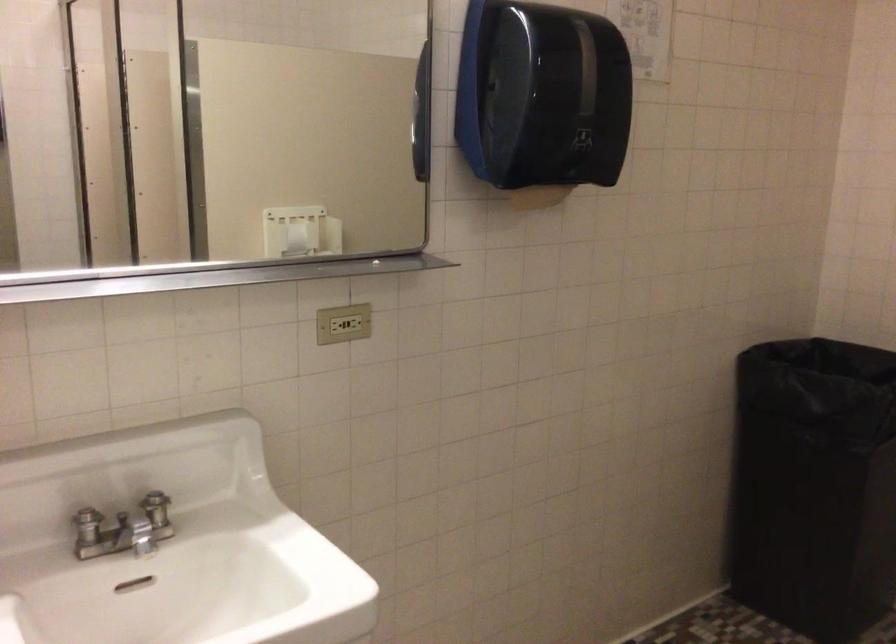
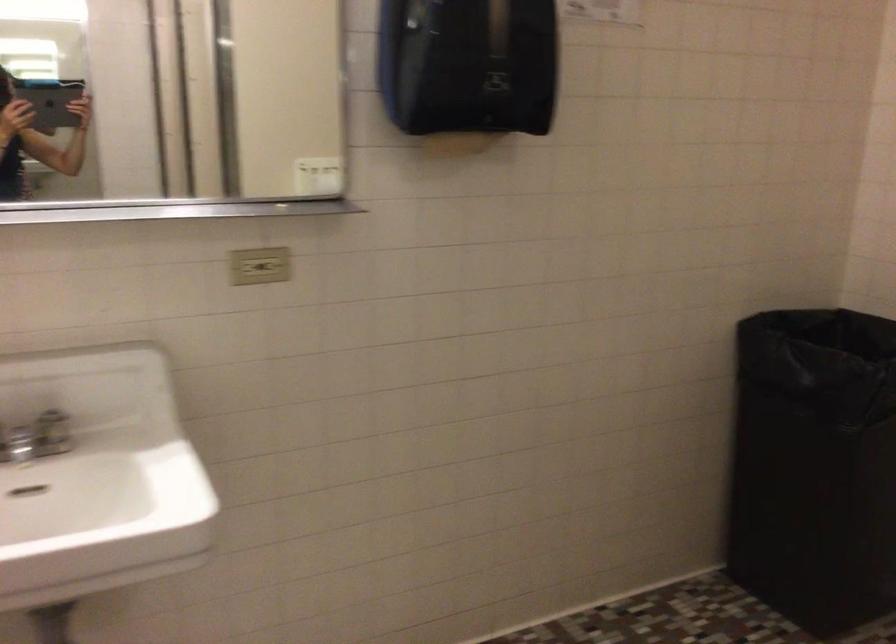
In the second image, find the point that corresponds to the point at 354,323 in the first image.

(273, 266)